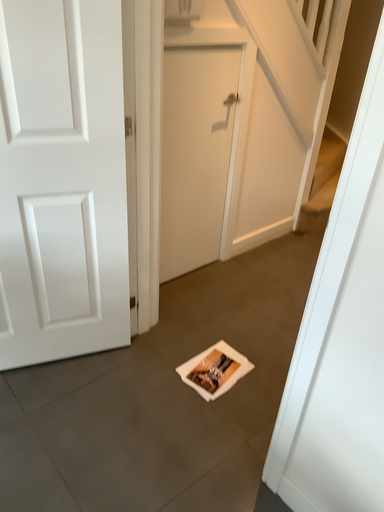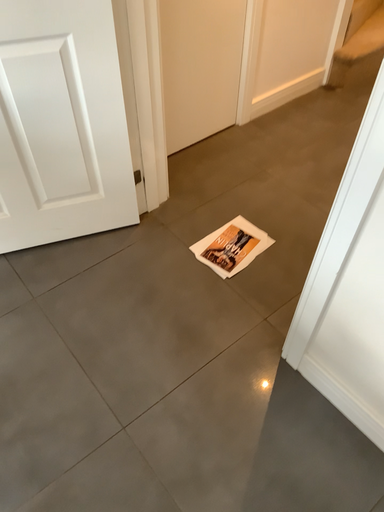
Question: How did the camera likely rotate when shooting the video?

Choices:
 (A) rotated upward
 (B) rotated downward

Answer: (B)